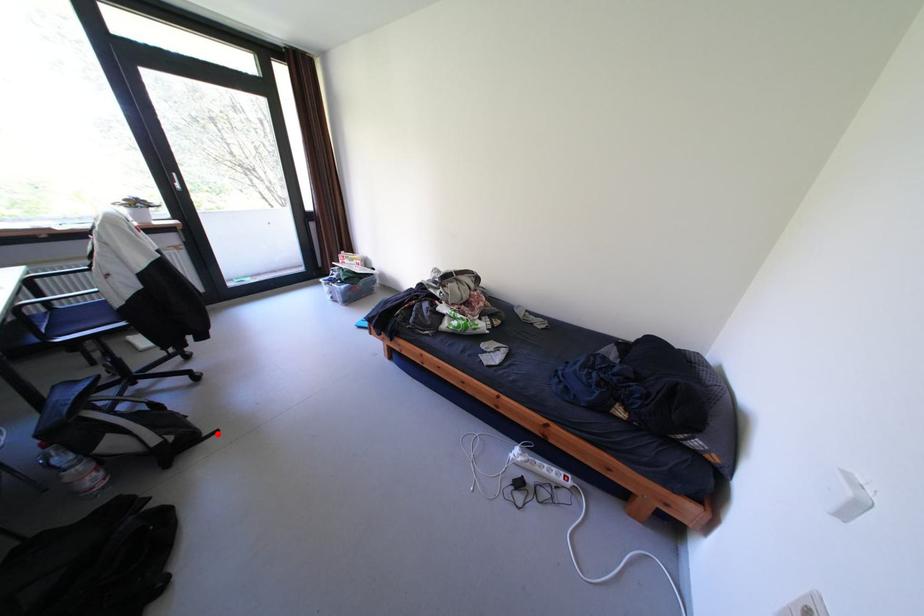
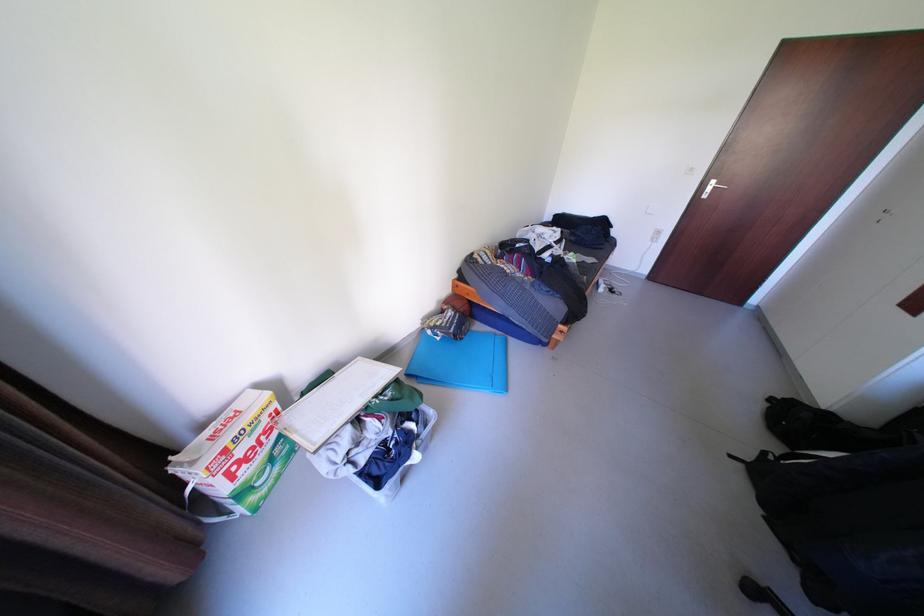
Where in the second image is the point corresponding to the highlighted location from the first image?

(752, 466)